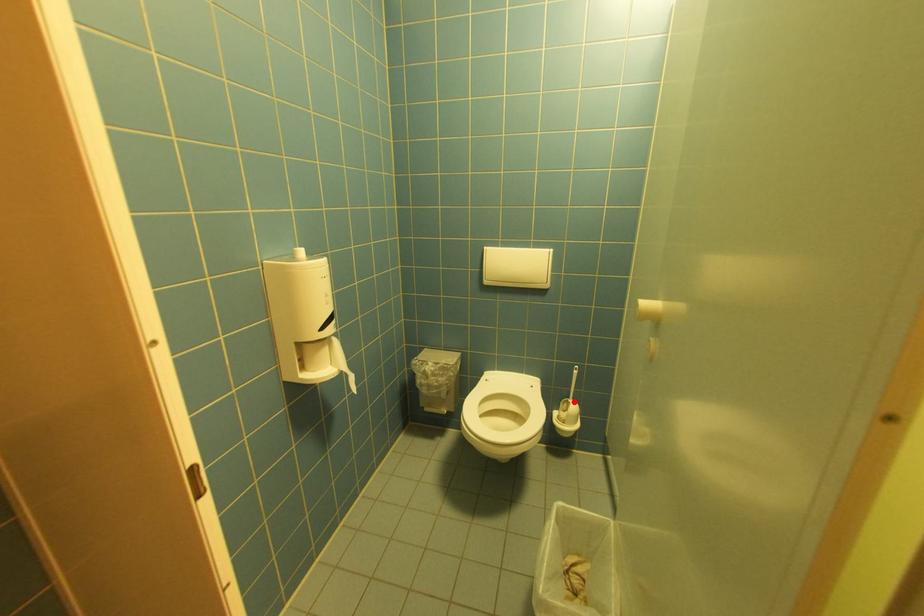
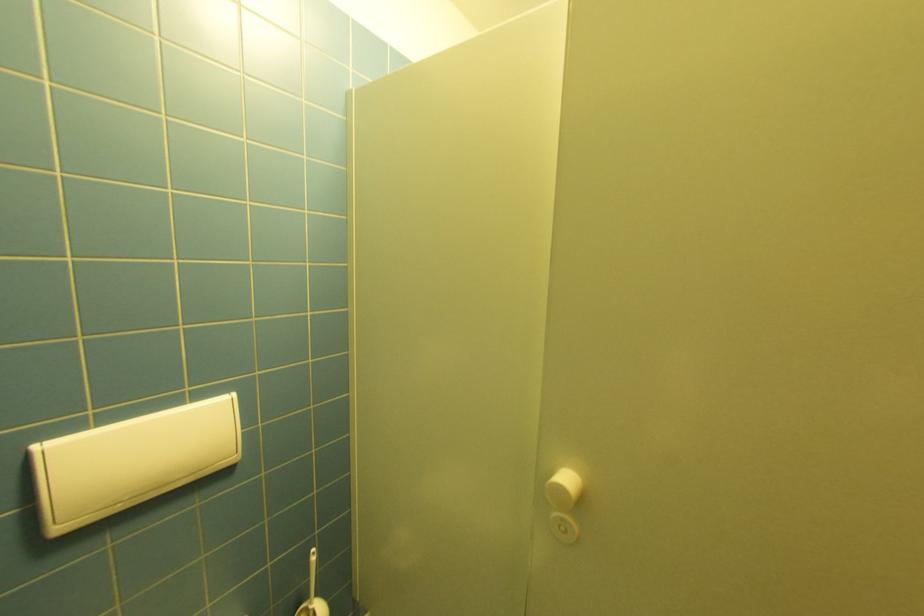
Question: I am providing you with two images of the same scene from different viewpoints. Given a red point in image1, look at the same physical point in image2. Is it:

Choices:
 (A) Closer to the viewpoint
 (B) Farther from the viewpoint

Answer: (A)